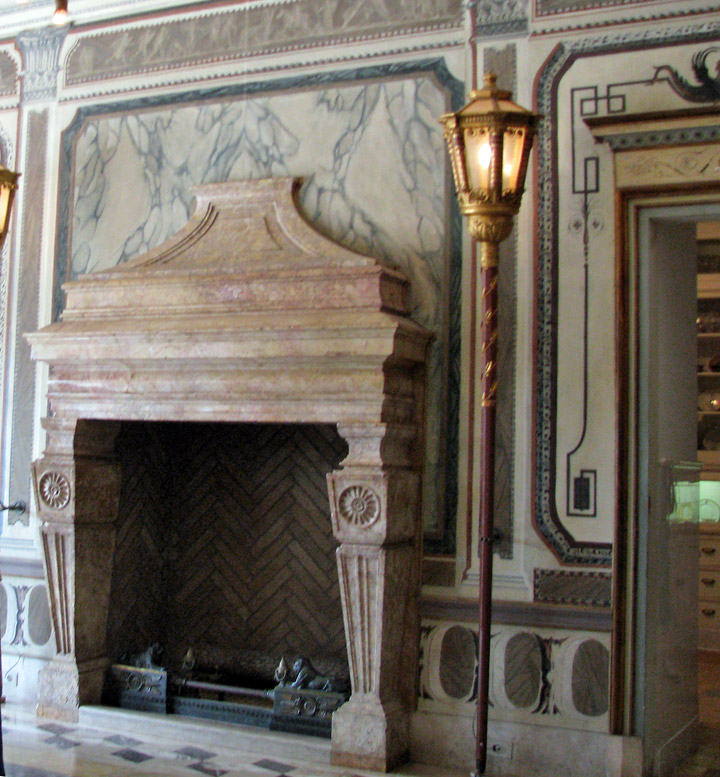
Where is `firebox`? firebox is located at coordinates (214, 688).